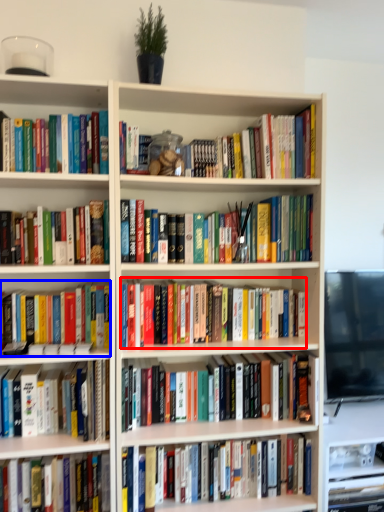
Question: Which of the following is the closest to the observer, book (highlighted by a red box) or book (highlighted by a blue box)?

Choices:
 (A) book
 (B) book

Answer: (B)